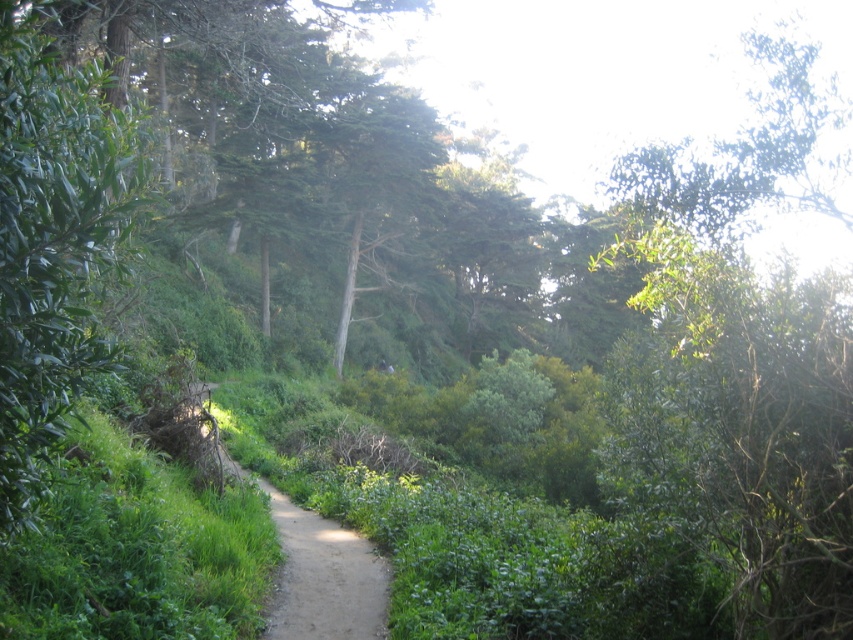
In the scene shown: Who is positioned more to the right, green leafy tree at left or dirt path at center?

From the viewer's perspective, green leafy tree at left appears more on the right side.

Who is taller, green leafy tree at left or dirt path at center?

With more height is green leafy tree at left.

Is point (16, 324) positioned before point (306, 557)?

Yes, point (16, 324) is in front of point (306, 557).

You are a GUI agent. You are given a task and a screenshot of the screen. Output one action in this format:
    pyautogui.click(x=<x>, y=<y>)
    Task: Click on the green leafy tree at left
    
    Given the screenshot: What is the action you would take?
    pyautogui.click(x=53, y=241)